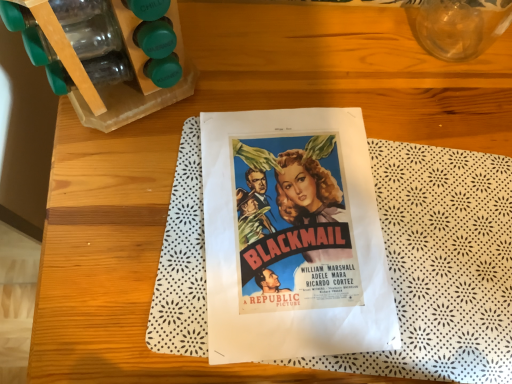
This screenshot has height=384, width=512. I want to click on free location to the left of vivid paper poster at center, so click(x=133, y=221).